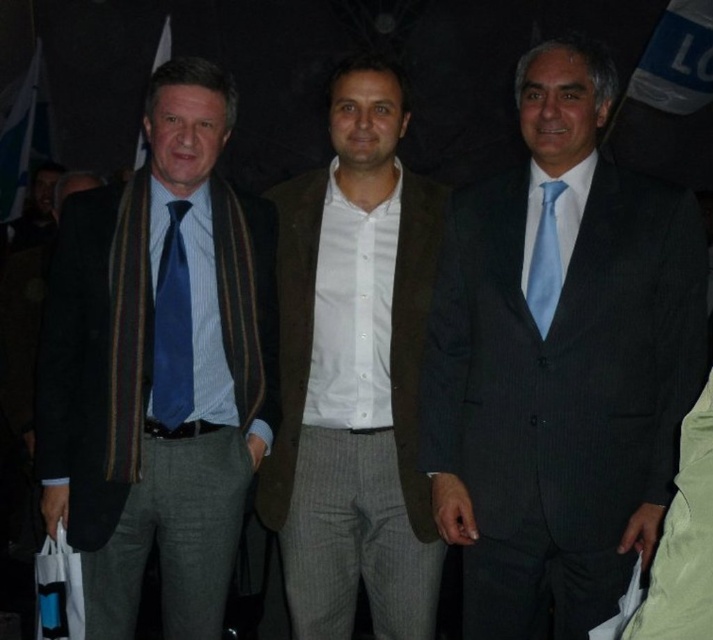
Question: Can you confirm if brown woolen blazer at center is positioned below light blue silk tie at right?

Choices:
 (A) yes
 (B) no

Answer: (A)

Question: Which is farther from the blue silk tie at left?

Choices:
 (A) light blue silk tie at right
 (B) brown woolen blazer at center
 (C) matte black suit at center

Answer: (A)

Question: Which object is farther from the camera taking this photo?

Choices:
 (A) brown woolen blazer at center
 (B) matte black suit at center
 (C) light blue silk tie at right

Answer: (A)

Question: Can you confirm if matte black suit at left is wider than brown woolen blazer at center?

Choices:
 (A) yes
 (B) no

Answer: (A)

Question: Among these points, which one is farthest from the camera?

Choices:
 (A) (506, 212)
 (B) (548, 241)
 (C) (195, 124)

Answer: (A)

Question: Is brown woolen blazer at center wider than blue silk tie at left?

Choices:
 (A) no
 (B) yes

Answer: (B)